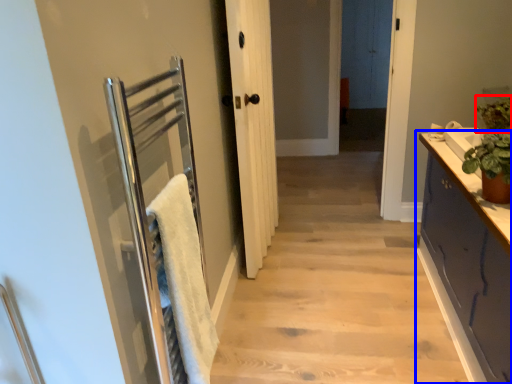
Question: Which point is closer to the camera, plant (highlighted by a red box) or cabinetry (highlighted by a blue box)?

Choices:
 (A) plant
 (B) cabinetry

Answer: (B)